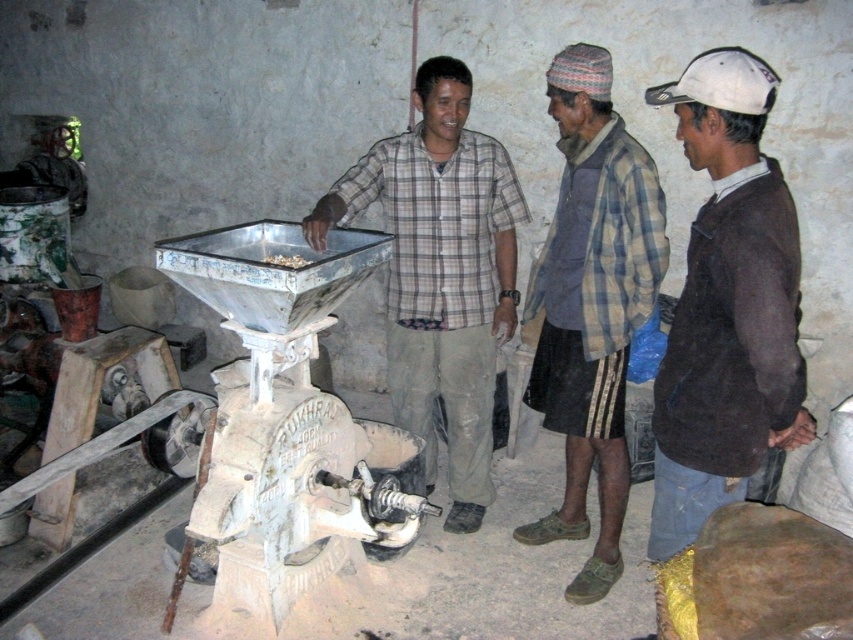
Question: Which point is closer to the camera?

Choices:
 (A) plaid shirt at center
 (B) brown sweater at right
 (C) plaid fabric shirt at center

Answer: (B)

Question: Is brown sweater at right above plaid shirt at center?

Choices:
 (A) yes
 (B) no

Answer: (B)

Question: Is brown sweater at right below plaid shirt at center?

Choices:
 (A) no
 (B) yes

Answer: (B)

Question: Which point is closer to the camera?

Choices:
 (A) brown sweater at right
 (B) plaid shirt at center
 (C) plaid fabric shirt at center
 (D) white matte food at center

Answer: (A)

Question: Can you confirm if plaid fabric shirt at center is positioned to the left of white matte food at center?

Choices:
 (A) no
 (B) yes

Answer: (A)

Question: Which point appears farthest from the camera in this image?

Choices:
 (A) [686, 264]
 (B) [570, 224]

Answer: (B)